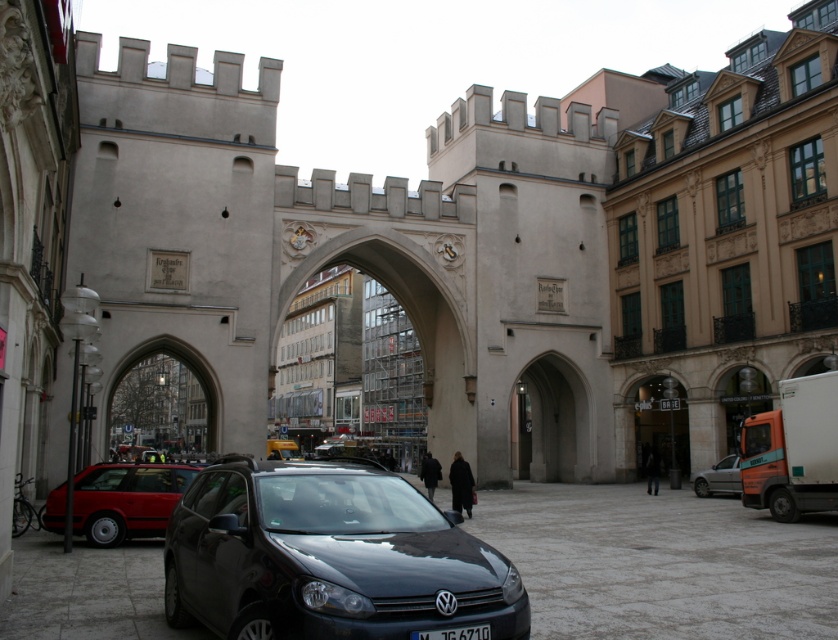
You are a delivery person who needs to park your delivery van in the plaza in front of the medieval archway. The van requires a parking space that is at least 30 meters long. Based on the distance between the shiny red sedan at lower left and the black plastic license plate at center, can you determine if there is enough space for your van in the plaza?

The distance between the shiny red sedan at lower left and the black plastic license plate at center is 25.64 meters, which is shorter than the required 30 meters. Therefore, there is not enough space for the van in the plaza.

You are a delivery driver who needs to park your vehicle in this plaza. You have a van that is 1.8 meters tall. Can you safely park your van between the shiny black car at center and the silver metallic sedan at lower right without hitting the medieval archway above?

The shiny black car at center is taller than the silver metallic sedan at lower right. Since your van is 1.8 meters tall, you need to compare its height with the tallest vehicle in the space. If the shiny black car at center is taller than the silver metallic sedan, and assuming the archway clearance is at least as high as the tallest vehicle, then parking between them should be possible. However, without knowing the exact height of the archway, it is risky. But since the question focuses on the space and 1

You are a pedestrian standing in the plaza in front of the medieval city gate. You see the shiny red sedan at lower left and the black plastic license plate at center. Which object is closer to you?

The shiny red sedan at lower left is closer to you than the black plastic license plate at center.